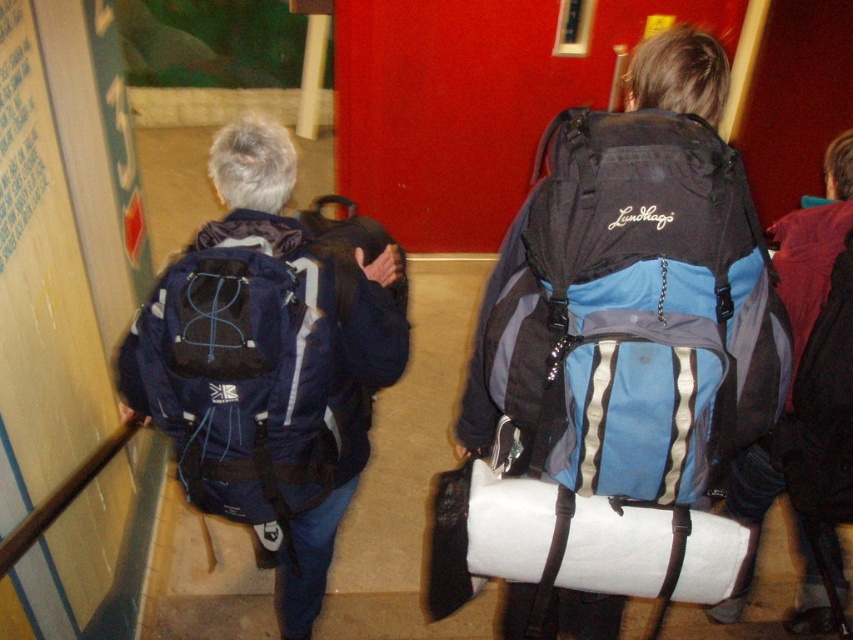
Measure the distance between point (x=241, y=356) and camera.

Point (x=241, y=356) is 4.81 feet away from camera.

Which is above, navy blue fabric backpack at left or blue fabric backpack at center?

blue fabric backpack at center

Where is `navy blue fabric backpack at left`? navy blue fabric backpack at left is located at coordinates (241, 378).

Is matte blue backpack at left positioned at the back of navy blue fabric backpack at left?

Yes, it is behind navy blue fabric backpack at left.

Does point (380, 282) lie in front of point (199, 492)?

No, (380, 282) is behind (199, 492).

The height and width of the screenshot is (640, 853). I want to click on matte blue backpack at left, so click(x=267, y=364).

Does matte blue backpack at left have a greater width compared to blue fabric backpack at center?

Correct, the width of matte blue backpack at left exceeds that of blue fabric backpack at center.

Does matte blue backpack at left appear under blue fabric backpack at center?

Yes, matte blue backpack at left is below blue fabric backpack at center.

Which is in front, point (343, 413) or point (732, 484)?

Point (343, 413) is more forward.

Where is `matte blue backpack at left`? This screenshot has width=853, height=640. matte blue backpack at left is located at coordinates (267, 364).